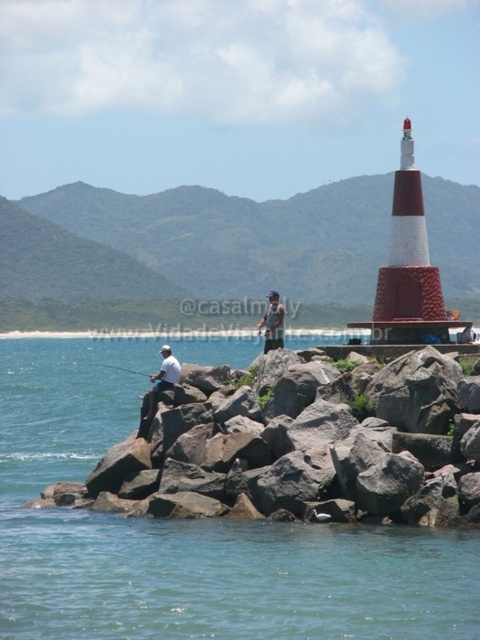
From the picture: You are a photographer trying to capture the lighthouse in the background. You notice the transparent blue water at center and the white matte shirt at left in your current frame. Which object should you adjust your camera to focus on to ensure the lighthouse is clearly visible?

The transparent blue water at center is wider than the white matte shirt at left, so focusing on the transparent blue water at center would provide a clearer view of the lighthouse in the background.

From the picture: You are a drone operator trying to capture a photo of the transparent blue water at center. The drone must hover exactly at the 2D coordinates provided in the scene description. What coordinates should you set the drone to hover at?

The transparent blue water at center should be captured by hovering the drone at coordinates point (188, 536).

You are a photographer standing on the jetty and want to capture the white matte shirt at left and the transparent blue water at center in your shot. Which object will appear lower in the photo?

The transparent blue water at center appears lower in the photo because it is positioned below the white matte shirt at left.